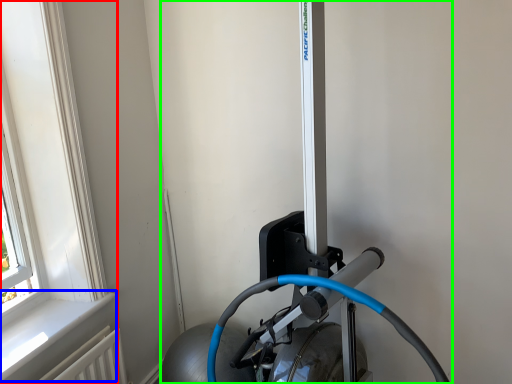
Question: Which object is the closest to the window (highlighted by a red box)? Choose among these: window sill (highlighted by a blue box) or sport equipment (highlighted by a green box).

Choices:
 (A) window sill
 (B) sport equipment

Answer: (A)